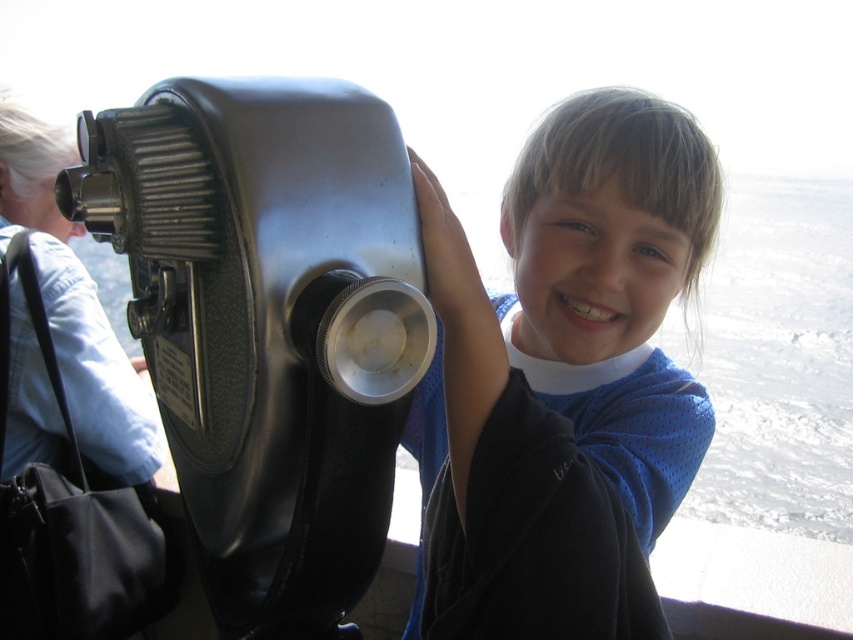
Between point (260, 252) and point (491, 365), which one is positioned in front?

Positioned in front is point (260, 252).

How much distance is there between metallic gray telescope at left and blue mesh shirt at center?

The distance of metallic gray telescope at left from blue mesh shirt at center is 15.19 inches.

This screenshot has width=853, height=640. Find the location of `metallic gray telescope at left`. metallic gray telescope at left is located at coordinates (268, 324).